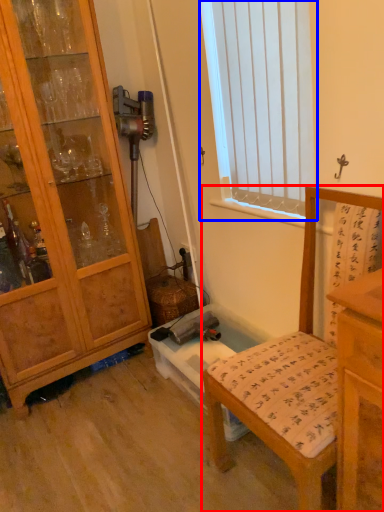
Question: Which object appears farthest to the camera in this image, chair (highlighted by a red box) or window (highlighted by a blue box)?

Choices:
 (A) chair
 (B) window

Answer: (B)